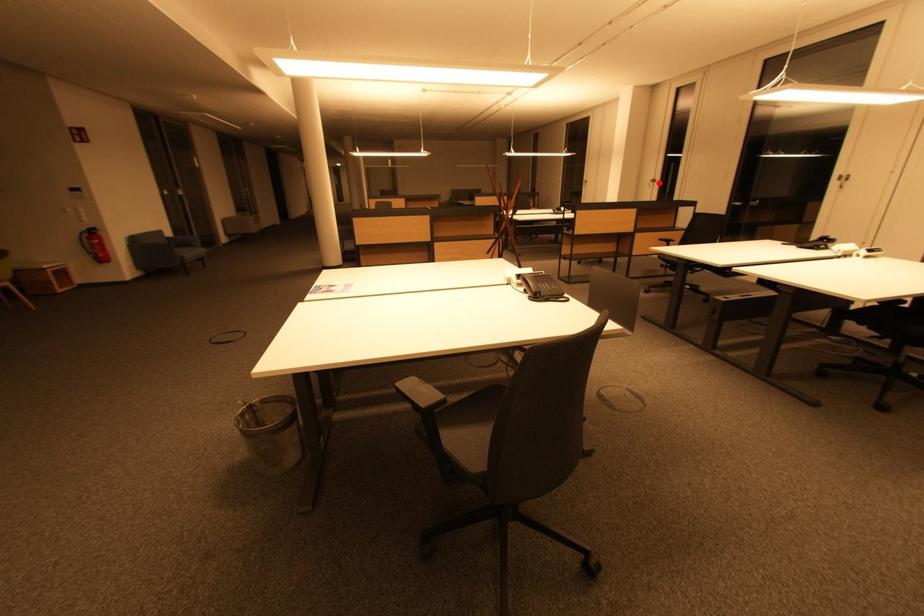
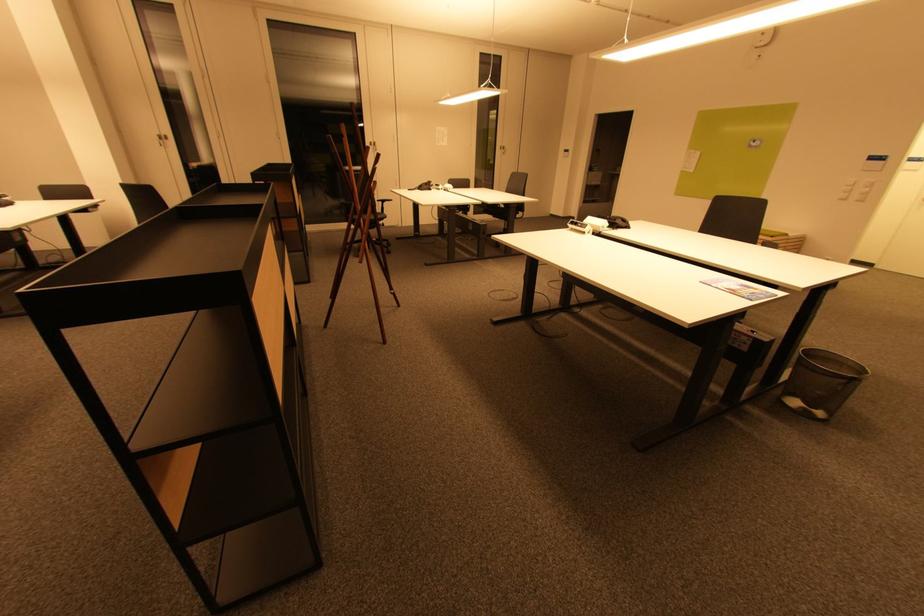
Where in the second image is the point corresponding to the highlighted location from the first image?

(166, 140)